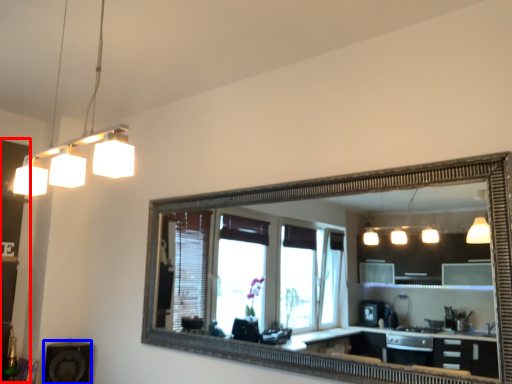
Question: Which point is further to the camera, dresser (highlighted by a red box) or speaker (highlighted by a blue box)?

Choices:
 (A) dresser
 (B) speaker

Answer: (B)